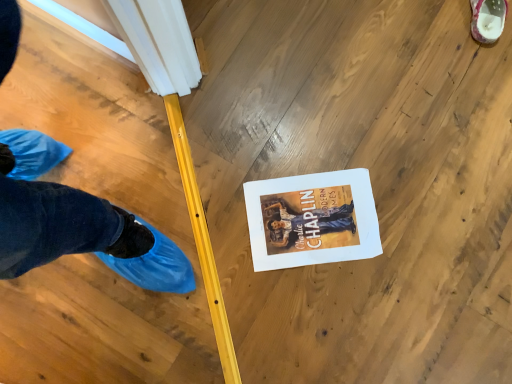
This screenshot has width=512, height=384. In order to click on free location to the right of white paper at center in this screenshot , I will do `click(416, 219)`.